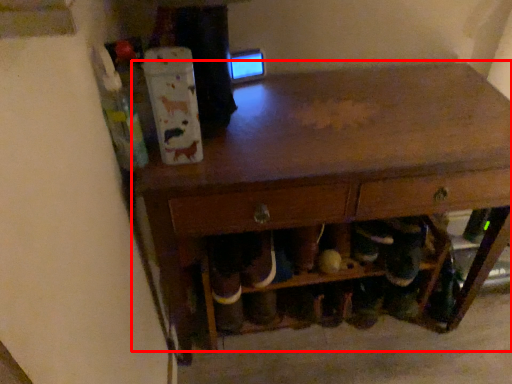
Question: From the image's perspective, what is the correct spatial positioning of table (annotated by the red box) in reference to shelf?

Choices:
 (A) below
 (B) above

Answer: (B)